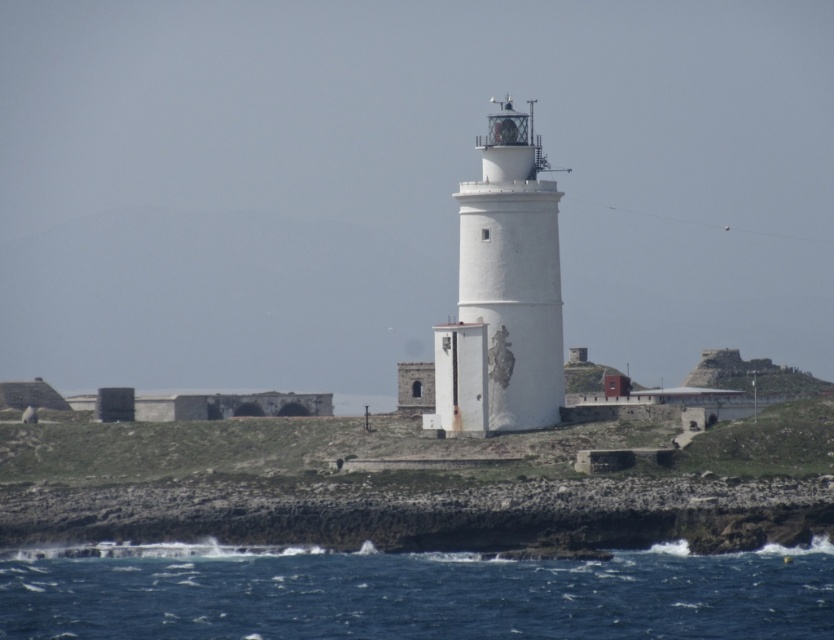
Question: Which point is closer to the camera taking this photo?

Choices:
 (A) (112, 564)
 (B) (486, 404)

Answer: (A)

Question: Does blue water at lower left have a smaller size compared to white smooth lighthouse at center?

Choices:
 (A) yes
 (B) no

Answer: (A)

Question: Which object appears closest to the camera in this image?

Choices:
 (A) white smooth lighthouse at center
 (B) blue water at lower left

Answer: (B)

Question: Does blue water at lower left have a greater width compared to white smooth lighthouse at center?

Choices:
 (A) no
 (B) yes

Answer: (B)

Question: Is blue water at lower left bigger than white smooth lighthouse at center?

Choices:
 (A) yes
 (B) no

Answer: (B)